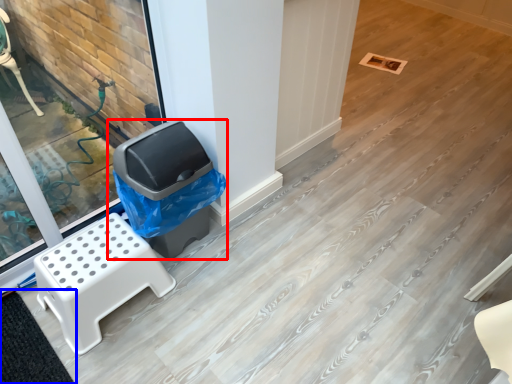
Question: Which object is closer to the camera taking this photo, waste container (highlighted by a red box) or mat (highlighted by a blue box)?

Choices:
 (A) waste container
 (B) mat

Answer: (B)